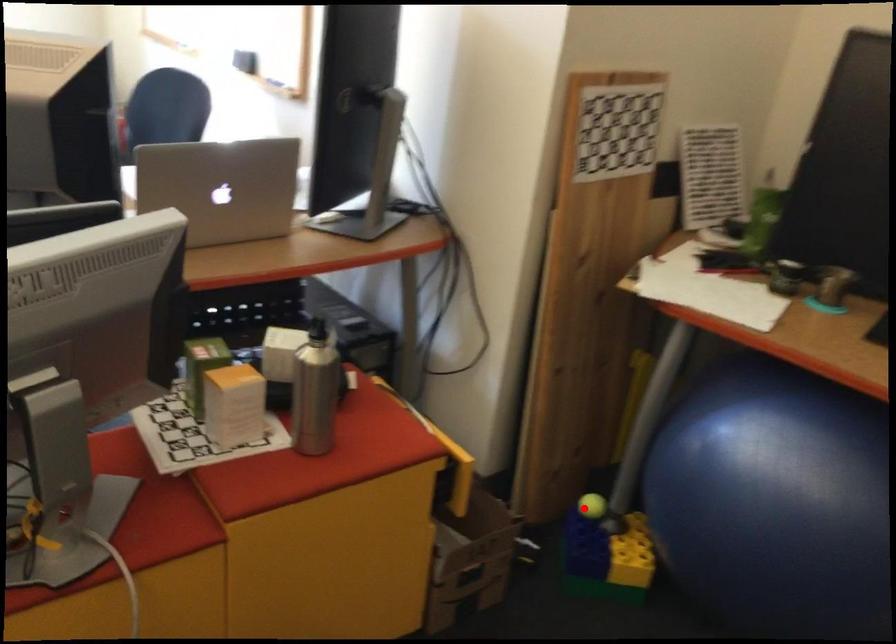
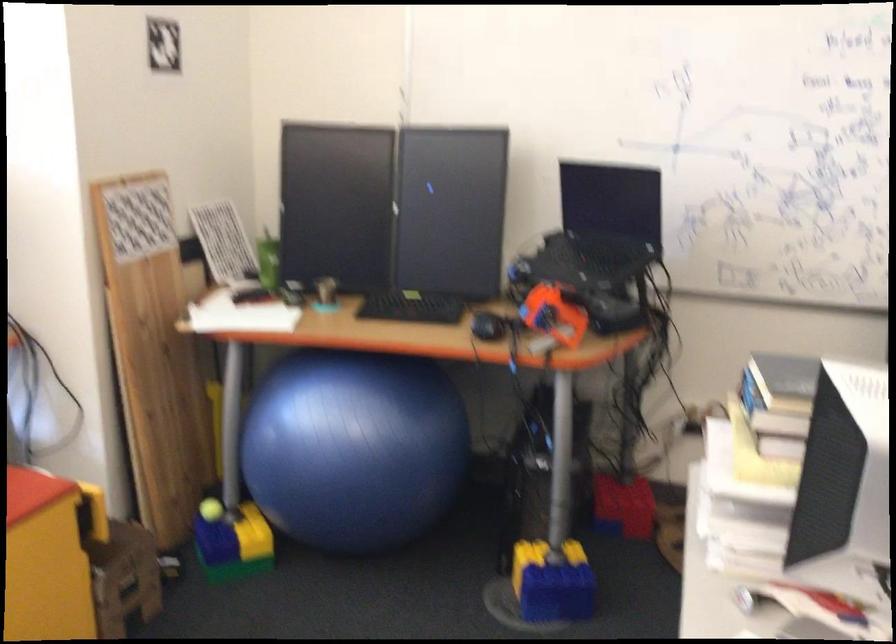
The point at the highlighted location is marked in the first image. Where is the corresponding point in the second image?

(211, 509)